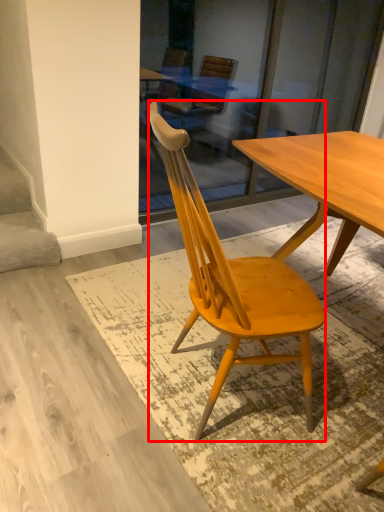
Question: Observing the image, what is the correct spatial positioning of chair (annotated by the red box) in reference to stairwell?

Choices:
 (A) right
 (B) left

Answer: (A)